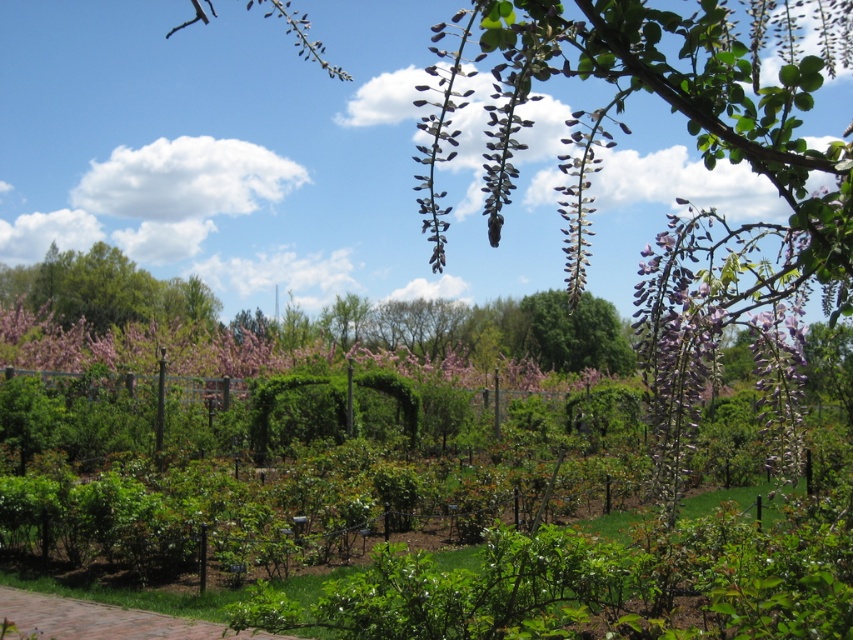
You are a gardener planning to place a decorative statue between the pink matte flowers at center and the green leafy tree at upper left. Which object should the statue be closer to if it needs to be placed near the smaller of the two?

The statue should be placed closer to the green leafy tree at upper left because the pink matte flowers at center are larger in size, making the green leafy tree at upper left the smaller object between them.

You are standing at the entrance of the garden and want to walk towards the brick paved path at lower center. Which direction should you walk relative to the pink matte flowers at center?

You should walk to the right of the pink matte flowers at center because the brick paved path at lower center is located to the right of them.